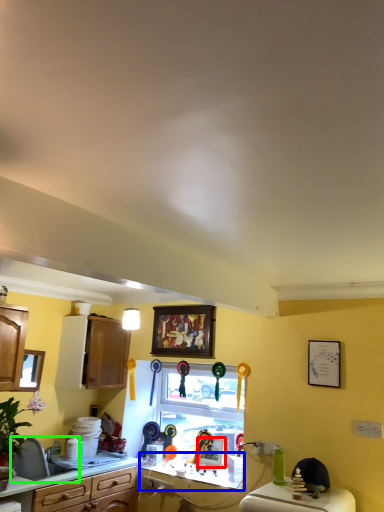
Question: Based on their relative distances, which object is farther from picture frame (highlighted by a red box)? Choose from counter top (highlighted by a blue box) and sink (highlighted by a green box).

Choices:
 (A) counter top
 (B) sink

Answer: (B)